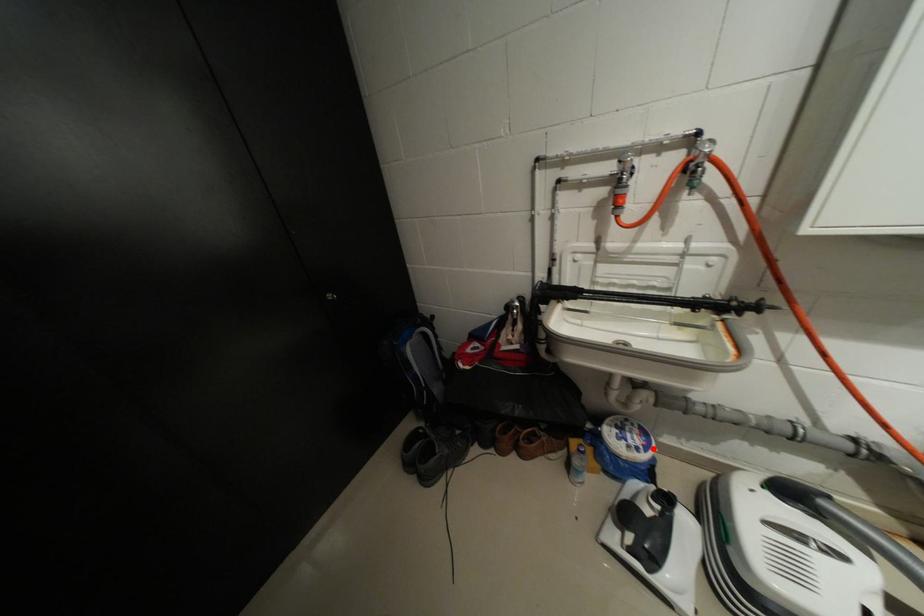
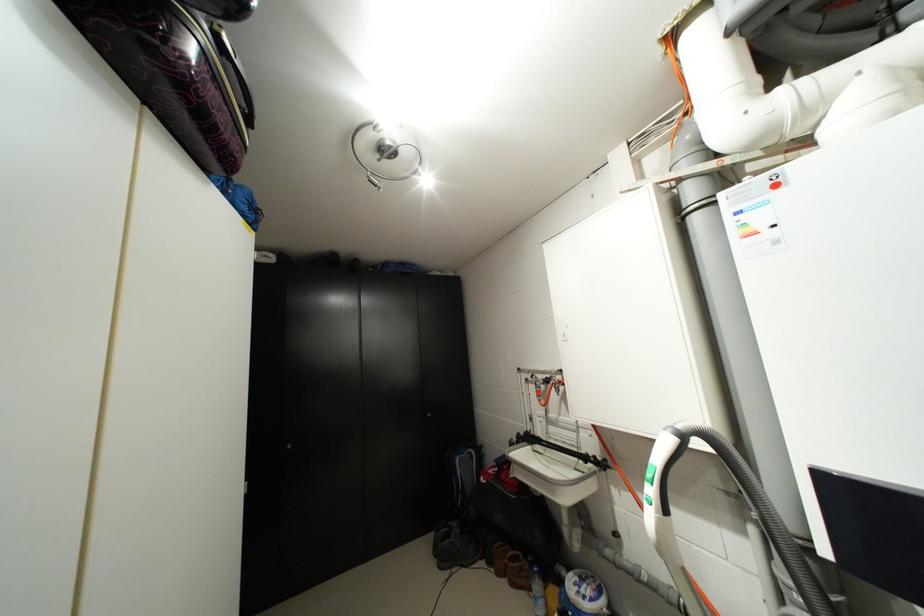
The point at the highlighted location is marked in the first image. Where is the corresponding point in the second image?

(599, 600)